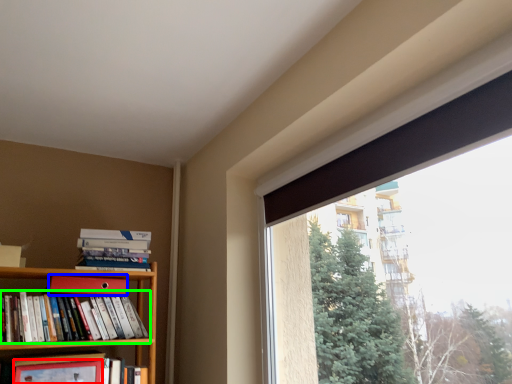
Question: Which object is the closest to the paperback book (highlighted by a red box)? Choose among these: paperback book (highlighted by a blue box) or book (highlighted by a green box).

Choices:
 (A) paperback book
 (B) book

Answer: (B)